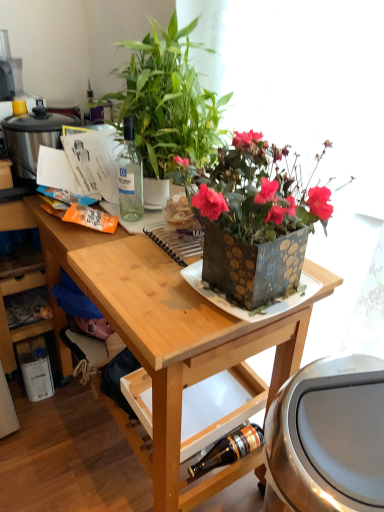
What do you see at coordinates (329, 436) in the screenshot?
I see `brushed metal trash can at lower right, the 2th appliance when ordered from top to bottom` at bounding box center [329, 436].

In the scene shown: What is the approximate width of brushed metal trash can at lower right, placed as the 2th appliance when sorted from back to front?

brushed metal trash can at lower right, placed as the 2th appliance when sorted from back to front, is 14.87 inches wide.

What is the approximate width of wooden desk at center?

21.96 inches.

The height and width of the screenshot is (512, 384). Describe the element at coordinates (172, 339) in the screenshot. I see `wooden desk at center` at that location.

You are a GUI agent. You are given a task and a screenshot of the screen. Output one action in this format:
    pyautogui.click(x=<x>, y=<y>)
    Task: Click on the transparent glass bottle at upper left, which ranks as the 1th bottle in top-to-bottom order
    The image size is (384, 512).
    Given the screenshot: What is the action you would take?
    pyautogui.click(x=130, y=176)

At what (x,y) coordinates should I click in order to perform the action: click on stainless steel rice cooker at left, which ranks as the 1th appliance in back-to-front order. Please return your answer as a coordinate pair (x, y). The width and height of the screenshot is (384, 512). Looking at the image, I should click on (32, 138).

What is the approximate height of brown glass bottle at lower center, arranged as the 2th bottle when viewed from the top?

2.18 inches.

At what (x,y) coordinates should I click in order to perform the action: click on green glossy plant at upper center. Please return your answer as a coordinate pair (x, y). This screenshot has height=512, width=384. Looking at the image, I should click on (168, 101).

Locate an element on the screen. The height and width of the screenshot is (512, 384). desk that appears in front of the green glossy plant at upper center is located at coordinates (172, 339).

Considering the relative sizes of wooden desk at center and green glossy plant at upper center in the image provided, is wooden desk at center bigger than green glossy plant at upper center?

Indeed, wooden desk at center has a larger size compared to green glossy plant at upper center.

Are wooden desk at center and green glossy plant at upper center located far from each other?

That's not correct — wooden desk at center is a little close to green glossy plant at upper center.

From a real-world perspective, is wooden desk at center positioned over green glossy plant at upper center based on gravity?

Incorrect, from a real-world perspective, wooden desk at center is lower than green glossy plant at upper center.

Is green glossy plant at upper center oriented away from stainless steel rice cooker at left, the 2th appliance in the bottom-to-top sequence?

green glossy plant at upper center does not have its back to stainless steel rice cooker at left, the 2th appliance in the bottom-to-top sequence.

From the image's perspective, which is above, green glossy plant at upper center or stainless steel rice cooker at left, which ranks as the 1th appliance in back-to-front order?

green glossy plant at upper center, from the image's perspective.

Find the location of a particular element. The width and height of the screenshot is (384, 512). appliance lying behind the green glossy plant at upper center is located at coordinates (32, 138).

Is green glossy plant at upper center with stainless steel rice cooker at left, marked as the second appliance in a right-to-left arrangement?

No, green glossy plant at upper center is not next to stainless steel rice cooker at left, marked as the second appliance in a right-to-left arrangement.

Considering the sizes of objects stainless steel rice cooker at left, the 2th appliance in the bottom-to-top sequence, and metallic square plate at center in the image provided, who is taller, stainless steel rice cooker at left, the 2th appliance in the bottom-to-top sequence, or metallic square plate at center?

Standing taller between the two is stainless steel rice cooker at left, the 2th appliance in the bottom-to-top sequence.

Which of these two, stainless steel rice cooker at left, which is the second appliance in front-to-back order, or metallic square plate at center, is smaller?

Smaller between the two is metallic square plate at center.

Would you say stainless steel rice cooker at left, which is the second appliance in front-to-back order, is outside metallic square plate at center?

Yes.

From a real-world perspective, is stainless steel rice cooker at left, the 2th appliance in the bottom-to-top sequence, positioned over metallic square plate at center based on gravity?

Yes, from a real-world perspective, stainless steel rice cooker at left, the 2th appliance in the bottom-to-top sequence, is over metallic square plate at center

Is there a large distance between stainless steel rice cooker at left, marked as the second appliance in a right-to-left arrangement, and green glossy plant at upper center?

No, stainless steel rice cooker at left, marked as the second appliance in a right-to-left arrangement, is not far from green glossy plant at upper center.

Image resolution: width=384 pixels, height=512 pixels. I want to click on houseplant that is on the right side of stainless steel rice cooker at left, which is the second appliance in front-to-back order, so click(168, 101).

Does stainless steel rice cooker at left, marked as the second appliance in a right-to-left arrangement, have a smaller size compared to green glossy plant at upper center?

Correct, stainless steel rice cooker at left, marked as the second appliance in a right-to-left arrangement, occupies less space than green glossy plant at upper center.

Between brown glass bottle at lower center, which is counted as the first bottle, starting from the right, and metallic square plate at center, which one appears on the right side from the viewer's perspective?

metallic square plate at center.

In the image, is brown glass bottle at lower center, positioned as the first bottle in bottom-to-top order, positioned in front of or behind metallic square plate at center?

Clearly, brown glass bottle at lower center, positioned as the first bottle in bottom-to-top order, is behind metallic square plate at center.

Are brown glass bottle at lower center, which is counted as the first bottle, starting from the right, and metallic square plate at center far apart?

brown glass bottle at lower center, which is counted as the first bottle, starting from the right, is near metallic square plate at center, not far away.

Does brushed metal trash can at lower right, which is the 1th appliance from bottom to top, have a smaller size compared to stainless steel rice cooker at left, the 2th appliance in the bottom-to-top sequence?

No, brushed metal trash can at lower right, which is the 1th appliance from bottom to top, is not smaller than stainless steel rice cooker at left, the 2th appliance in the bottom-to-top sequence.

Does point (332, 509) appear closer or farther from the camera than point (33, 154)?

Clearly, point (332, 509) is closer to the camera than point (33, 154).

I want to click on appliance located behind the brushed metal trash can at lower right, the 2th appliance when ordered from top to bottom, so click(x=32, y=138).

Considering the sizes of objects brushed metal trash can at lower right, the 2th appliance when ordered from top to bottom, and stainless steel rice cooker at left, which ranks as the 1th appliance in left-to-right order, in the image provided, who is wider, brushed metal trash can at lower right, the 2th appliance when ordered from top to bottom, or stainless steel rice cooker at left, which ranks as the 1th appliance in left-to-right order,?

brushed metal trash can at lower right, the 2th appliance when ordered from top to bottom, is wider.

Considering the relative positions of stainless steel rice cooker at left, which is the second appliance in front-to-back order, and transparent glass bottle at upper left, the 2th bottle from the right, in the image provided, is stainless steel rice cooker at left, which is the second appliance in front-to-back order, to the left of transparent glass bottle at upper left, the 2th bottle from the right, from the viewer's perspective?

Indeed, stainless steel rice cooker at left, which is the second appliance in front-to-back order, is positioned on the left side of transparent glass bottle at upper left, the 2th bottle from the right.

From a real-world perspective, does stainless steel rice cooker at left, which ranks as the 1th appliance in back-to-front order, stand above transparent glass bottle at upper left, which ranks as the 1th bottle in top-to-bottom order?

Incorrect, from a real-world perspective, stainless steel rice cooker at left, which ranks as the 1th appliance in back-to-front order, is lower than transparent glass bottle at upper left, which ranks as the 1th bottle in top-to-bottom order.

Which object is closer to the camera taking this photo, stainless steel rice cooker at left, the 1th appliance when ordered from top to bottom, or transparent glass bottle at upper left, which ranks as the 1th bottle in top-to-bottom order?

transparent glass bottle at upper left, which ranks as the 1th bottle in top-to-bottom order, is in front.

Is stainless steel rice cooker at left, marked as the second appliance in a right-to-left arrangement, far away from transparent glass bottle at upper left, the 2th bottle from the right?

stainless steel rice cooker at left, marked as the second appliance in a right-to-left arrangement, is actually quite close to transparent glass bottle at upper left, the 2th bottle from the right.

Where is `houseplant above the wooden desk at center (from the image's perspective)`? houseplant above the wooden desk at center (from the image's perspective) is located at coordinates (168, 101).

From the image's perspective, starting from the green glossy plant at upper center, which appliance is the 1st one below? Please provide its 2D coordinates.

[(32, 138)]

Looking at the image, which one is located further to wooden desk at center, stainless steel rice cooker at left, the 2th appliance in the bottom-to-top sequence, or green glossy plant at upper center?

Based on the image, stainless steel rice cooker at left, the 2th appliance in the bottom-to-top sequence, appears to be further to wooden desk at center.

Looking at this image, estimate the real-world distances between objects in this image. Which object is further from brushed metal trash can at lower right, which is the first appliance in front-to-back order, metallic square plate at center or transparent glass bottle at upper left, positioned as the 1th bottle in left-to-right order?

Among the two, transparent glass bottle at upper left, positioned as the 1th bottle in left-to-right order, is located further to brushed metal trash can at lower right, which is the first appliance in front-to-back order.

Which object lies nearer to the anchor point wooden desk at center, brushed metal trash can at lower right, placed as the second appliance when sorted from left to right, or metallic square plate at center?

metallic square plate at center is positioned closer to the anchor wooden desk at center.

Which object lies further to the anchor point stainless steel rice cooker at left, which ranks as the 1th appliance in back-to-front order, green glossy plant at upper center or wooden desk at center?

wooden desk at center is further to stainless steel rice cooker at left, which ranks as the 1th appliance in back-to-front order.

From the image, which object appears to be farther from green glossy plant at upper center, brown glass bottle at lower center, positioned as the first bottle in bottom-to-top order, or brushed metal trash can at lower right, placed as the second appliance when sorted from left to right?

brown glass bottle at lower center, positioned as the first bottle in bottom-to-top order.

Considering their positions, is wooden desk at center positioned further to stainless steel rice cooker at left, the 2th appliance in the bottom-to-top sequence, than green glossy plant at upper center?

wooden desk at center lies further to stainless steel rice cooker at left, the 2th appliance in the bottom-to-top sequence, than the other object.

When comparing their distances from brushed metal trash can at lower right, placed as the 2th appliance when sorted from back to front, does transparent glass bottle at upper left, positioned as the 1th bottle in left-to-right order, or green glossy plant at upper center seem closer?

Among the two, green glossy plant at upper center is located nearer to brushed metal trash can at lower right, placed as the 2th appliance when sorted from back to front.

Considering their positions, is brushed metal trash can at lower right, placed as the 2th appliance when sorted from back to front, positioned closer to green glossy plant at upper center than transparent glass bottle at upper left, the 2th bottle from the right?

transparent glass bottle at upper left, the 2th bottle from the right, lies closer to green glossy plant at upper center than the other object.

Locate an element on the screen. The width and height of the screenshot is (384, 512). desk between green glossy plant at upper center and brushed metal trash can at lower right, placed as the 2th appliance when sorted from back to front, from top to bottom is located at coordinates (172, 339).

You are a GUI agent. You are given a task and a screenshot of the screen. Output one action in this format:
    pyautogui.click(x=<x>, y=<y>)
    Task: Click on the desk between stainless steel rice cooker at left, marked as the second appliance in a right-to-left arrangement, and brushed metal trash can at lower right, placed as the second appliance when sorted from left to right, in the vertical direction
    
    Given the screenshot: What is the action you would take?
    pyautogui.click(x=172, y=339)

Identify the location of desk between green glossy plant at upper center and brown glass bottle at lower center, arranged as the 2th bottle when viewed from the top, vertically. This screenshot has width=384, height=512. (172, 339).

Where is `houseplant between stainless steel rice cooker at left, the 2th appliance in the bottom-to-top sequence, and metallic square plate at center, in the horizontal direction`? The height and width of the screenshot is (512, 384). houseplant between stainless steel rice cooker at left, the 2th appliance in the bottom-to-top sequence, and metallic square plate at center, in the horizontal direction is located at coordinates (168, 101).